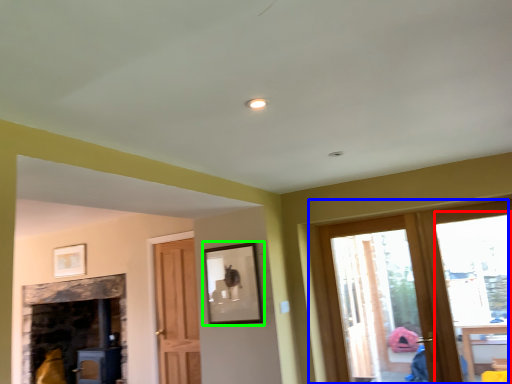
Question: Based on their relative distances, which object is nearer to window (highlighted by a red box)? Choose from window (highlighted by a blue box) and picture frame (highlighted by a green box).

Choices:
 (A) window
 (B) picture frame

Answer: (B)